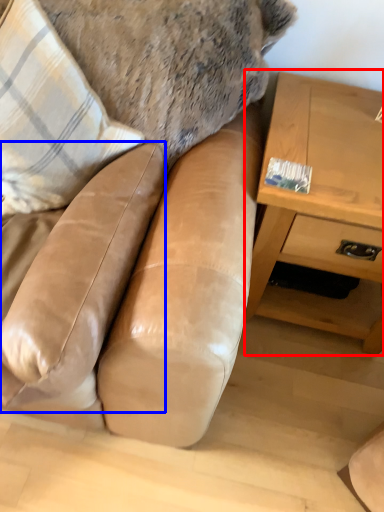
Question: Which point is further to the camera, table (highlighted by a red box) or swivel chair (highlighted by a blue box)?

Choices:
 (A) table
 (B) swivel chair

Answer: (A)